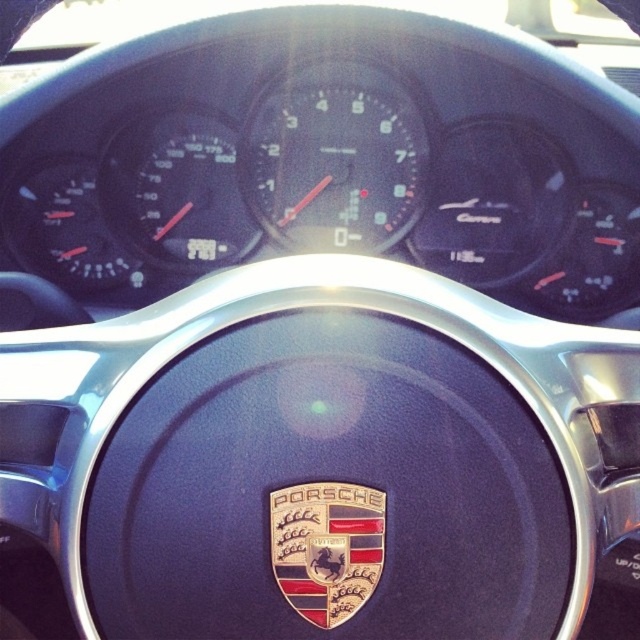
From the picture: Is matte black speedometer at center thinner than gold metallic porsche emblem at center?

No.

Measure the distance between matte black speedometer at center and camera.

matte black speedometer at center and camera are 1.42 meters apart from each other.

Locate an element on the screen. matte black speedometer at center is located at coordinates (333, 157).

Identify the location of matte black speedometer at center. (333, 157).